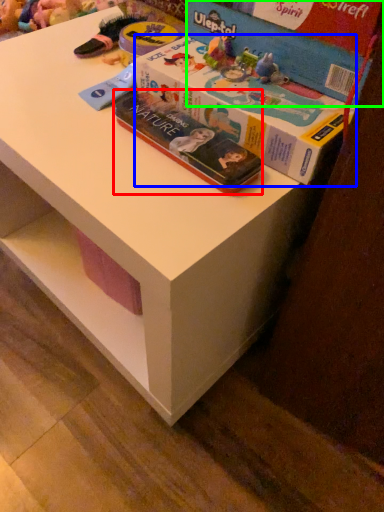
Question: Which object is the closest to the book (highlighted by a red box)? Choose among these: box (highlighted by a blue box) or box (highlighted by a green box).

Choices:
 (A) box
 (B) box

Answer: (A)